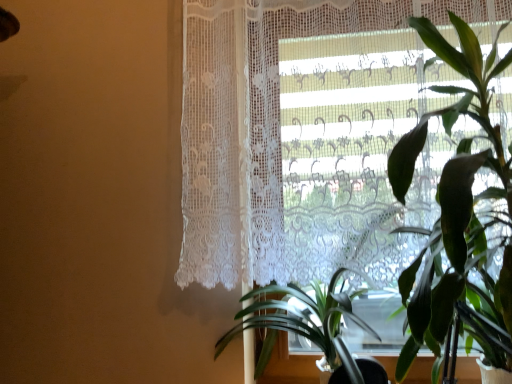
Question: Which direction should I rotate to look at green leafy plant at center, the second houseplant positioned from the right, — up or down?

Choices:
 (A) down
 (B) up

Answer: (A)

Question: Is green leafy plant at center, the second houseplant positioned from the right, oriented away from white lace curtain at upper right?

Choices:
 (A) no
 (B) yes

Answer: (A)

Question: Can you confirm if green leafy plant at center, the second houseplant positioned from the right, is wider than white lace curtain at upper right?

Choices:
 (A) no
 (B) yes

Answer: (B)

Question: Does green leafy plant at center, the first houseplant positioned from the left, lie in front of white lace curtain at upper right?

Choices:
 (A) yes
 (B) no

Answer: (A)

Question: Considering the relative positions of green leafy plant at center, the first houseplant positioned from the left, and white lace curtain at upper right in the image provided, is green leafy plant at center, the first houseplant positioned from the left, behind white lace curtain at upper right?

Choices:
 (A) no
 (B) yes

Answer: (A)

Question: From the image's perspective, is green leafy plant at center, the first houseplant positioned from the left, under white lace curtain at upper right?

Choices:
 (A) yes
 (B) no

Answer: (A)

Question: Is green leafy plant at center, the first houseplant positioned from the left, positioned beyond the bounds of white lace curtain at upper right?

Choices:
 (A) yes
 (B) no

Answer: (A)

Question: Is green leafy plant at right, the second houseplant positioned from the left, inside white lace curtain at upper right?

Choices:
 (A) no
 (B) yes

Answer: (A)

Question: From a real-world perspective, is white lace curtain at upper right below green leafy plant at right, the first houseplant in the right-to-left sequence?

Choices:
 (A) no
 (B) yes

Answer: (A)

Question: Does white lace curtain at upper right have a larger size compared to green leafy plant at right, the second houseplant positioned from the left?

Choices:
 (A) no
 (B) yes

Answer: (A)

Question: Can we say white lace curtain at upper right lies outside green leafy plant at right, the first houseplant in the right-to-left sequence?

Choices:
 (A) no
 (B) yes

Answer: (B)

Question: Is white lace curtain at upper right shorter than green leafy plant at right, the second houseplant positioned from the left?

Choices:
 (A) yes
 (B) no

Answer: (B)

Question: Does white lace curtain at upper right lie in front of green leafy plant at right, the second houseplant positioned from the left?

Choices:
 (A) no
 (B) yes

Answer: (A)

Question: From a real-world perspective, is green leafy plant at right, the second houseplant positioned from the left, located beneath white lace curtain at upper right?

Choices:
 (A) yes
 (B) no

Answer: (A)